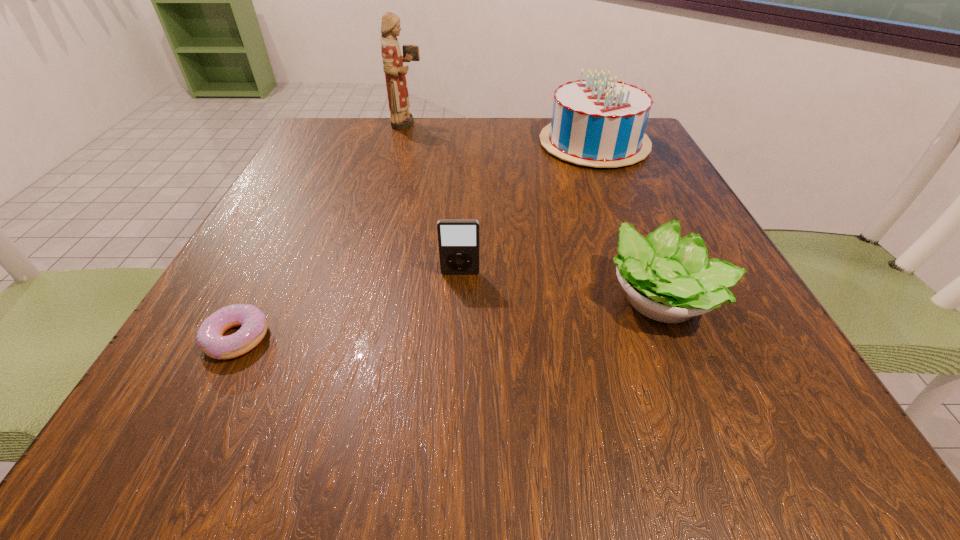
You are a GUI agent. You are given a task and a screenshot of the screen. Output one action in this format:
    pyautogui.click(x=<x>, y=<y>)
    Task: Click on the vacant space located 0.360m on the left of the lettuce
    This screenshot has width=960, height=540.
    Given the screenshot: What is the action you would take?
    pyautogui.click(x=364, y=299)

Find the location of `free space located on the right of the shortest object`. free space located on the right of the shortest object is located at coordinates (479, 338).

Where is `figurine that is at the far edge`? The width and height of the screenshot is (960, 540). figurine that is at the far edge is located at coordinates (400, 117).

Locate an element on the screen. birthday cake that is at the far edge is located at coordinates (599, 123).

This screenshot has height=540, width=960. I want to click on object that is positioned at the left edge, so click(x=210, y=339).

Locate an element on the screen. birthday cake that is positioned at the right edge is located at coordinates (599, 123).

Where is `lettuce positioned at the right edge`? lettuce positioned at the right edge is located at coordinates (669, 279).

The image size is (960, 540). What are the coordinates of `object that is at the far right corner` in the screenshot? It's located at (599, 123).

You are a GUI agent. You are given a task and a screenshot of the screen. Output one action in this format:
    pyautogui.click(x=<x>, y=<y>)
    Task: Click on the vacant space at the far edge
    The width and height of the screenshot is (960, 540).
    Given the screenshot: What is the action you would take?
    pyautogui.click(x=515, y=158)

At what (x,y) coordinates should I click in order to perform the action: click on vacant space at the near edge of the desktop. Please return your answer as a coordinate pair (x, y). Looking at the image, I should click on (362, 403).